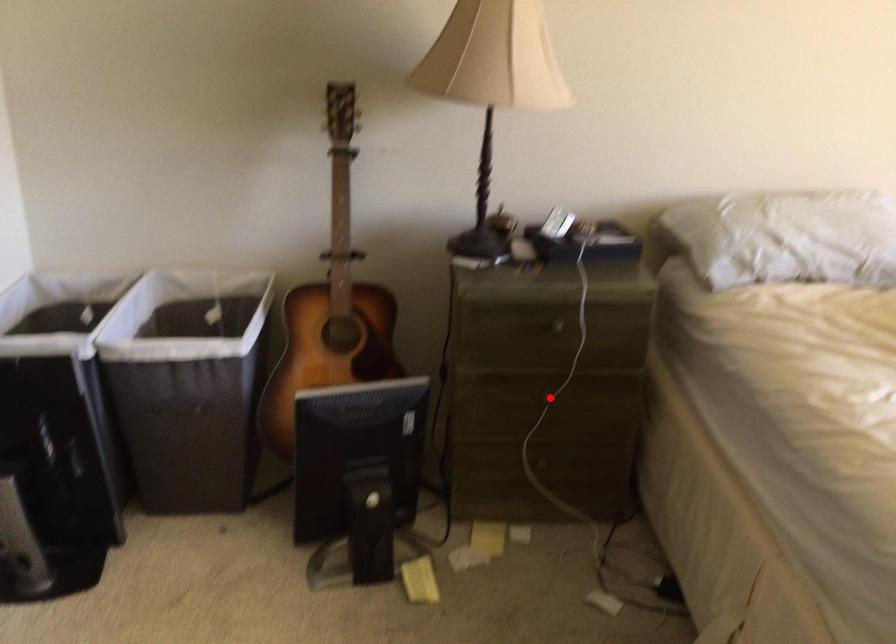
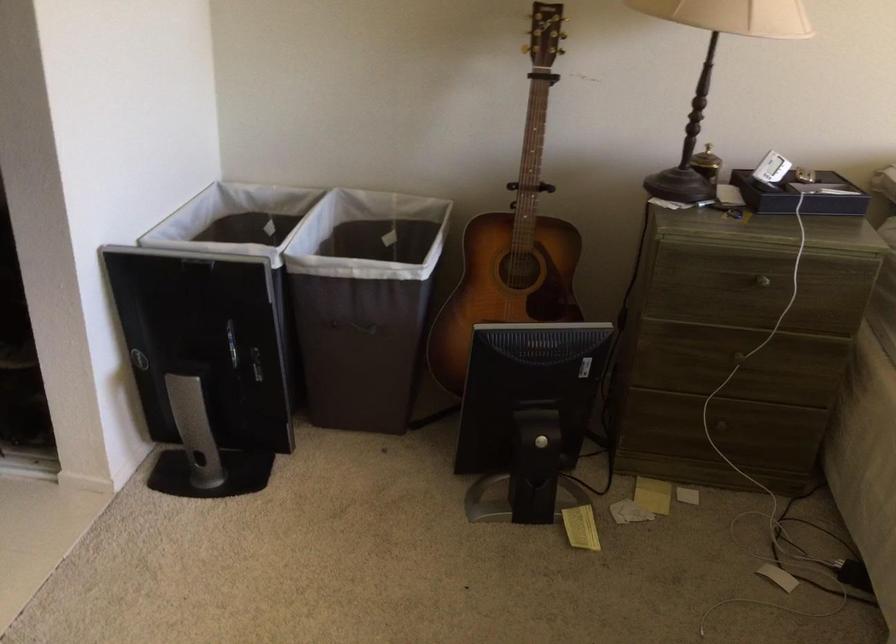
Find the pixel in the second image that matches the highlighted location in the first image.

(738, 357)